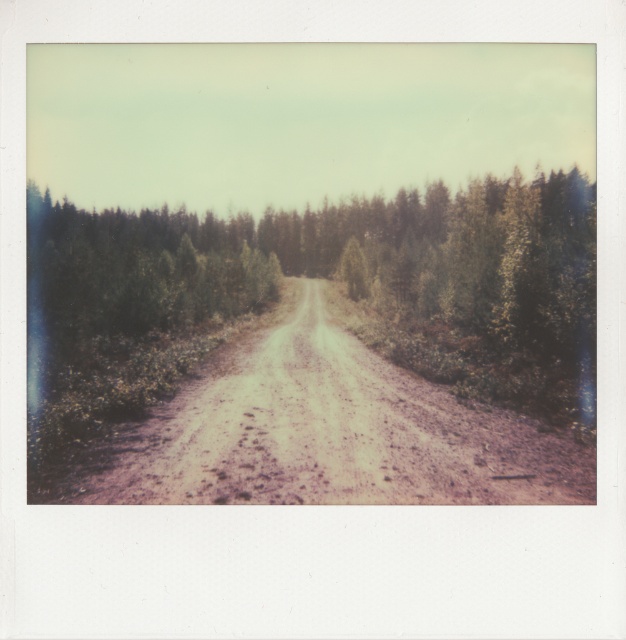
Does green textured forest at center have a greater height compared to dusty gravel road at center?

Yes, green textured forest at center is taller than dusty gravel road at center.

Who is more forward, (202, 272) or (332, 488)?

Point (332, 488) is in front.

Is point (69, 204) closer to camera compared to point (145, 493)?

No, (69, 204) is further to viewer.

Identify the location of green textured forest at center. This screenshot has height=640, width=626. (329, 276).